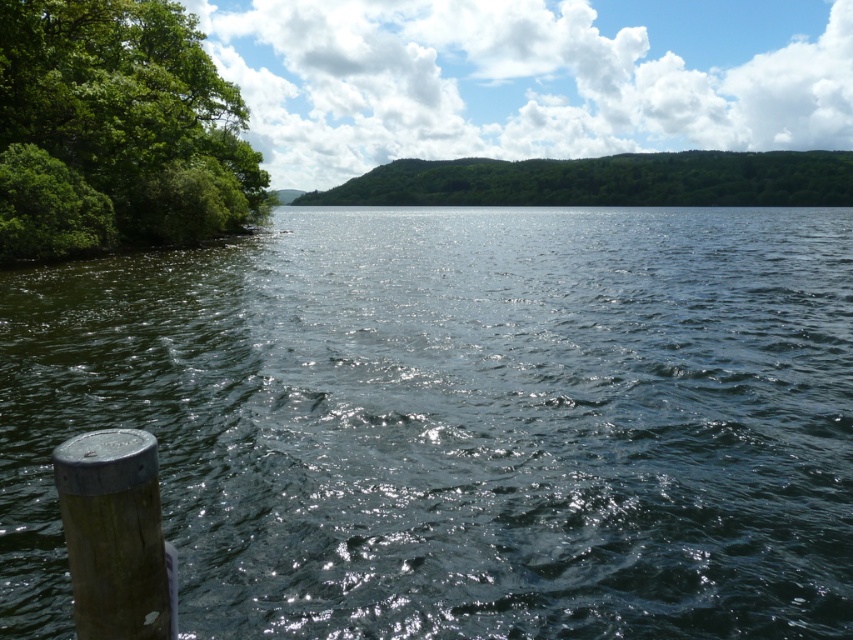
Which is behind, point (718, 588) or point (572, 195)?

The point (572, 195) is behind.

Between dark green water at center and green leafy forest at upper center, which one appears on the left side from the viewer's perspective?

dark green water at center is more to the left.

Which is behind, point (51, 632) or point (392, 164)?

The point (392, 164) is more distant.

Identify the location of dark green water at center. The image size is (853, 640). (457, 420).

Is green leafy forest at upper center taller than wooden post at lower left?

Indeed, green leafy forest at upper center has a greater height compared to wooden post at lower left.

Locate an element on the screen. This screenshot has height=640, width=853. green leafy forest at upper center is located at coordinates (605, 180).

I want to click on green leafy forest at upper center, so click(x=605, y=180).

The width and height of the screenshot is (853, 640). I want to click on green leafy forest at upper center, so click(605, 180).

Is point (215, 77) farther from camera compared to point (129, 637)?

That is True.

Is green leafy bush at left in front of wooden post at lower left?

No, it is not.

What are the coordinates of `green leafy bush at left` in the screenshot? It's located at (115, 129).

You are a GUI agent. You are given a task and a screenshot of the screen. Output one action in this format:
    pyautogui.click(x=<x>, y=<y>)
    Task: Click on the green leafy bush at left
    The height and width of the screenshot is (640, 853).
    Given the screenshot: What is the action you would take?
    pyautogui.click(x=115, y=129)